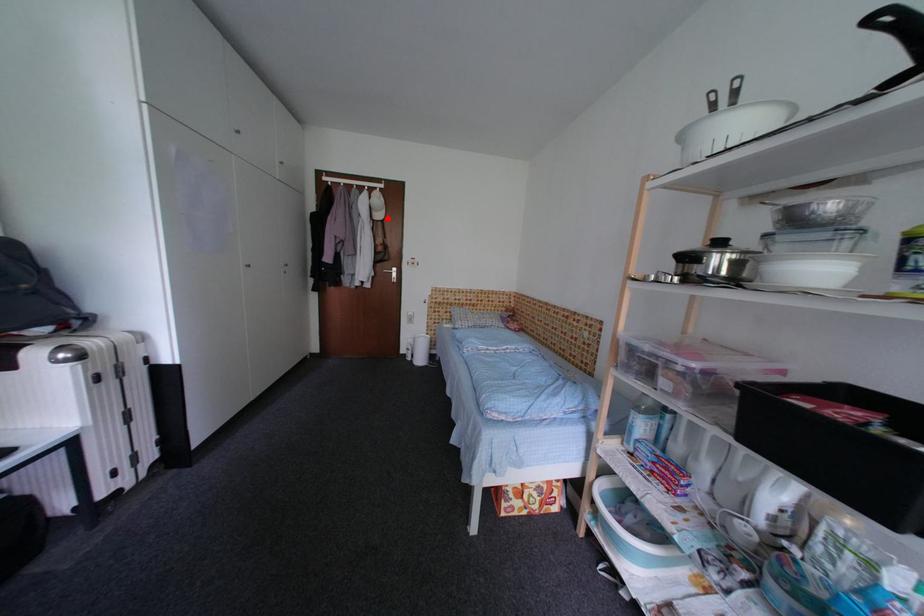
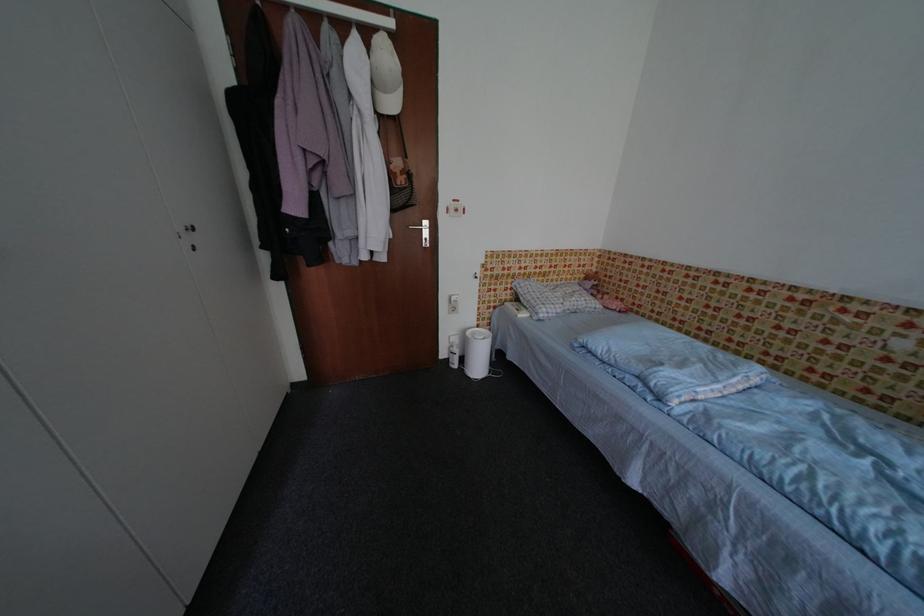
Find the pixel in the second image that matches the highlighted location in the first image.

(400, 107)